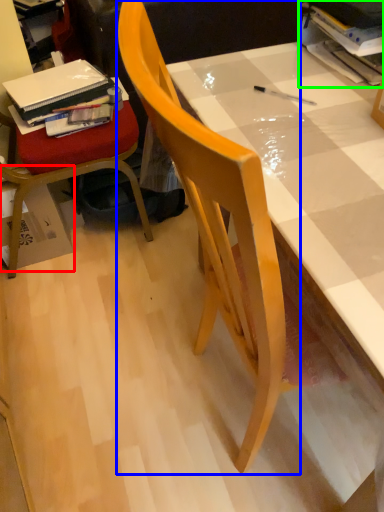
Question: Estimate the real-world distances between objects in this image. Which object is farther from cardboard box (highlighted by a red box), chair (highlighted by a blue box) or book (highlighted by a green box)?

Choices:
 (A) chair
 (B) book

Answer: (B)